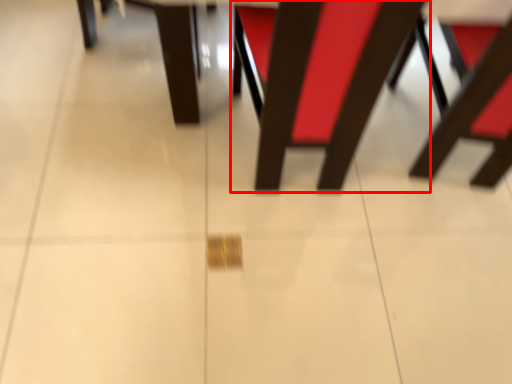
Question: From the image's perspective, where is chair (annotated by the red box) located in relation to chair in the image?

Choices:
 (A) above
 (B) below

Answer: (B)